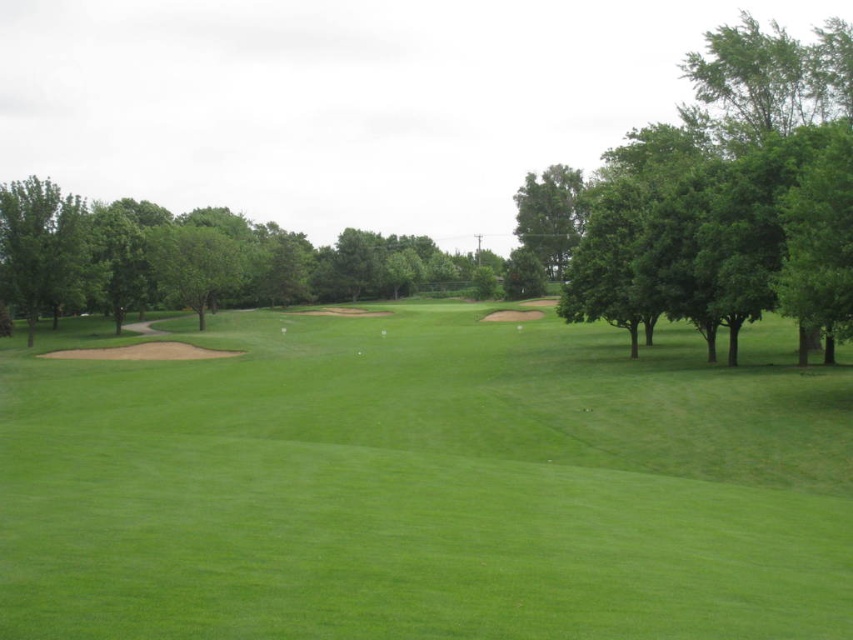
Based on the photo, you are a golfer standing on the fairway and want to hit a ball towards the green. There are two green leafy trees in your view. Which tree, the green leafy tree at left or the green leafy tree at upper center, is wider?

The green leafy tree at left is wider than the green leafy tree at upper center.

You are standing on the golf course and want to take a photo of the green grassy field at center and the green leafy tree at right. Which object will appear larger in your photo?

The green grassy field at center will appear larger in the photo because it is closer to the viewer than the green leafy tree at right.

You are standing at the center of the fairway and want to hit a golf ball towards the green leafy tree at right. In which direction should you aim?

You should aim to the right direction since the green leafy tree at right is located at the right side of the image.